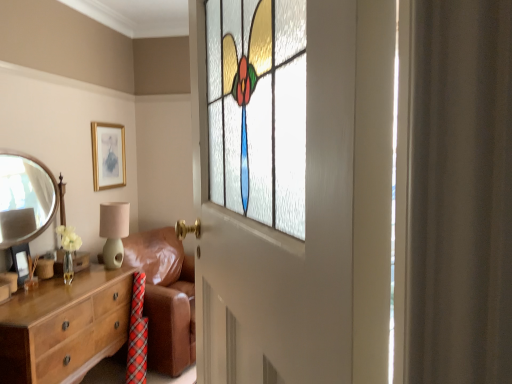
Question: Is brown leather couch at center positioned beyond the bounds of gold metallic picture frame at upper center, which appears as the first picture frame when viewed from the back?

Choices:
 (A) no
 (B) yes

Answer: (B)

Question: Considering the relative sizes of brown leather couch at center and gold metallic picture frame at upper center, marked as the first picture frame in a top-to-bottom arrangement, in the image provided, is brown leather couch at center smaller than gold metallic picture frame at upper center, marked as the first picture frame in a top-to-bottom arrangement,?

Choices:
 (A) no
 (B) yes

Answer: (A)

Question: Does brown leather couch at center turn towards gold metallic picture frame at upper center, the 2th picture frame when ordered from left to right?

Choices:
 (A) no
 (B) yes

Answer: (A)

Question: Would you say brown leather couch at center contains gold metallic picture frame at upper center, the 2th picture frame when ordered from left to right?

Choices:
 (A) no
 (B) yes

Answer: (A)

Question: From a real-world perspective, is brown leather couch at center beneath gold metallic picture frame at upper center, the 2th picture frame when ordered from left to right?

Choices:
 (A) yes
 (B) no

Answer: (A)

Question: In terms of size, does wooden chest of drawers at left appear bigger or smaller than gold metallic picture frame at upper center, the second picture frame from the front?

Choices:
 (A) big
 (B) small

Answer: (A)

Question: In terms of width, does wooden chest of drawers at left look wider or thinner when compared to gold metallic picture frame at upper center, the 2th picture frame when ordered from left to right?

Choices:
 (A) wide
 (B) thin

Answer: (A)

Question: Would you say wooden chest of drawers at left is to the left or to the right of gold metallic picture frame at upper center, the 2th picture frame when ordered from left to right, in the picture?

Choices:
 (A) right
 (B) left

Answer: (A)

Question: From a real-world perspective, relative to gold metallic picture frame at upper center, the 2th picture frame positioned from the bottom, is wooden chest of drawers at left vertically above or below?

Choices:
 (A) above
 (B) below

Answer: (B)

Question: Based on their positions, is matte green ceramic table lamp at left located to the left or right of wooden chest of drawers at left?

Choices:
 (A) left
 (B) right

Answer: (B)

Question: Is matte green ceramic table lamp at left wider or thinner than wooden chest of drawers at left?

Choices:
 (A) wide
 (B) thin

Answer: (B)

Question: Is point (120, 248) closer or farther from the camera than point (96, 314)?

Choices:
 (A) closer
 (B) farther

Answer: (B)

Question: Is matte green ceramic table lamp at left inside the boundaries of wooden chest of drawers at left, or outside?

Choices:
 (A) outside
 (B) inside

Answer: (A)

Question: Looking at the image, does wooden chest of drawers at left seem bigger or smaller compared to stained glass window at center?

Choices:
 (A) small
 (B) big

Answer: (B)

Question: In the image, is wooden chest of drawers at left positioned in front of or behind stained glass window at center?

Choices:
 (A) behind
 (B) front

Answer: (A)